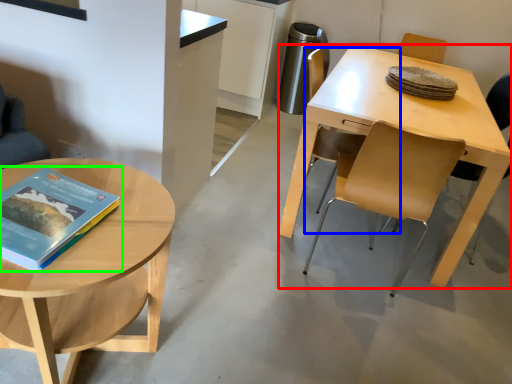
Question: Considering the real-world distances, which object is farthest from desk (highlighted by a red box)? chair (highlighted by a blue box) or book (highlighted by a green box)?

Choices:
 (A) chair
 (B) book

Answer: (B)